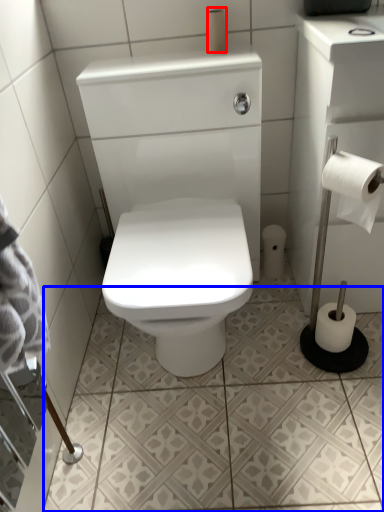
Question: Which object appears farthest to the camera in this image, toilet paper (highlighted by a red box) or ceramic tile (highlighted by a blue box)?

Choices:
 (A) toilet paper
 (B) ceramic tile

Answer: (A)